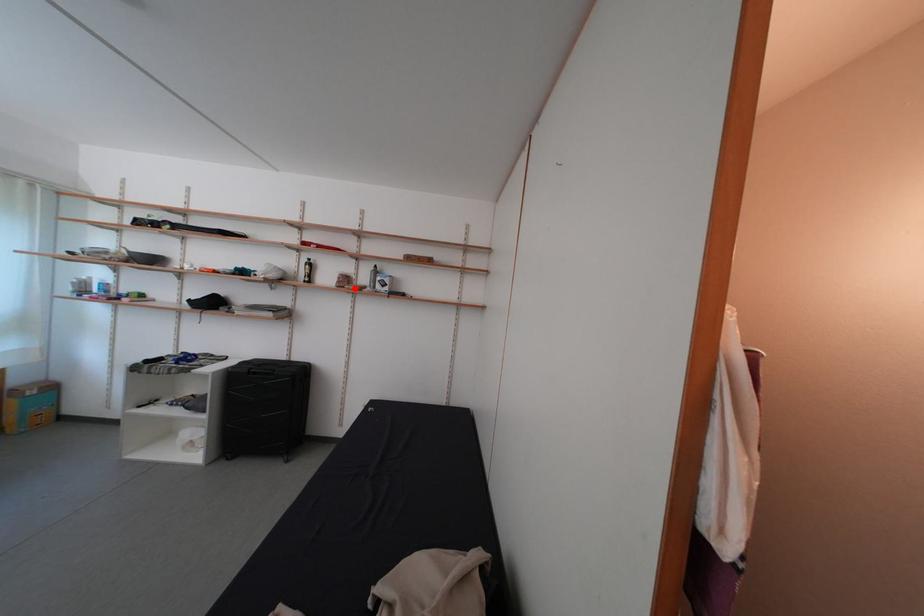
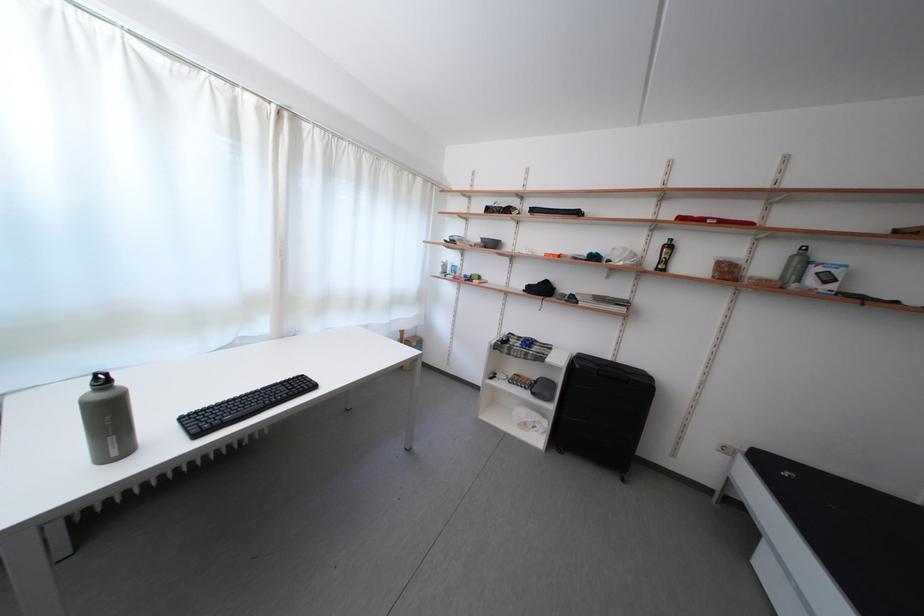
In the second image, find the point that corresponds to the highlighted location in the first image.

(736, 278)